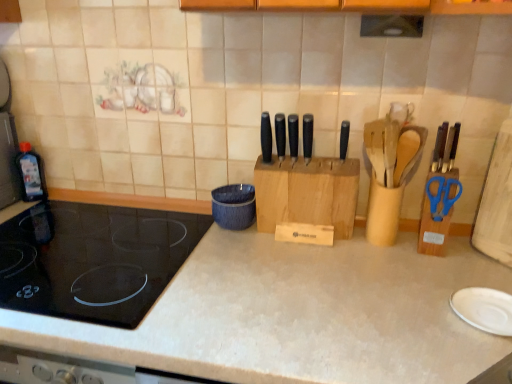
Question: Considering the positions of wooden knife block at center and black matte knife at center, marked as the first knife in a right-to-left arrangement, in the image, is wooden knife block at center taller or shorter than black matte knife at center, marked as the first knife in a right-to-left arrangement,?

Choices:
 (A) tall
 (B) short

Answer: (A)

Question: Relative to black matte knife at center, arranged as the fifth knife when viewed from the left, is wooden knife block at center in front or behind?

Choices:
 (A) front
 (B) behind

Answer: (B)

Question: Which of these objects is positioned farthest from the black matte knife at center, which appears as the second knife when viewed from the right?

Choices:
 (A) blue textured bowl at center
 (B) white matte countertop at center
 (C) black plastic knife at center, which is counted as the fourth knife, starting from the right
 (D) black matte knife at center, the third knife positioned from the left
 (E) black matte knife at center, marked as the first knife in a right-to-left arrangement

Answer: (B)

Question: Which is nearer to the black glass cooktop at left?

Choices:
 (A) blue textured bowl at center
 (B) wooden knife block at center
 (C) black plastic knife at center, which is the 2th knife from left to right
 (D) transparent plastic bottle at left
 (E) black matte knife at center, which appears as the second knife when viewed from the right

Answer: (A)